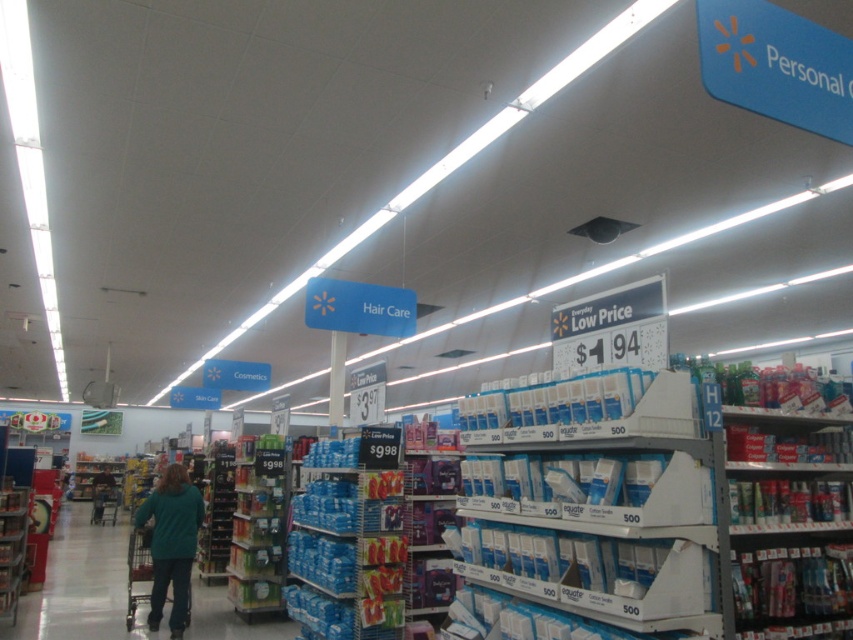
You are a delivery person who just arrived at the store and need to place a new shipment of white cardboard boxes at center in the correct location. According to the store layout, where should you place them?

You should place the white cardboard boxes at center at point (589, 506).

Based on the photo, you are a customer looking for a specific product in the retail store. You see the point marked at coordinate (589, 506). What object is located at that point?

The point at coordinate (589, 506) corresponds to white cardboard boxes at center.

You are shopping in the store and want to pick up the teal fabric shirt at center and the blue plastic shelf at lower left. Which item is located to the right of the other?

The teal fabric shirt at center is located to the right of the blue plastic shelf at lower left.